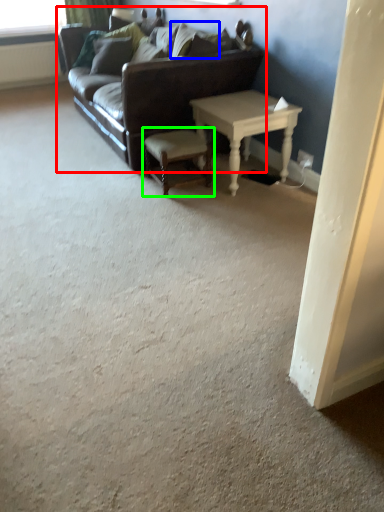
Question: Considering the real-world distances, which object is closest to studio couch (highlighted by a red box)? pillow (highlighted by a blue box) or stool (highlighted by a green box).

Choices:
 (A) pillow
 (B) stool

Answer: (B)